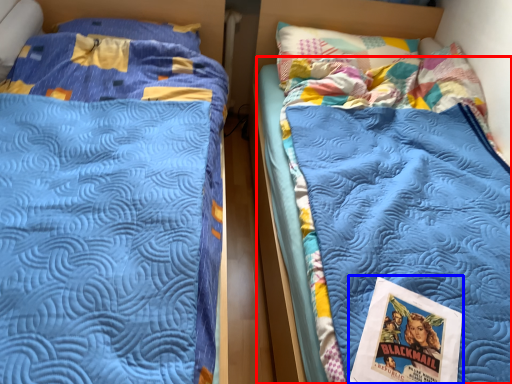
Question: Which point is further to the camera, mattress (highlighted by a red box) or comic book (highlighted by a blue box)?

Choices:
 (A) mattress
 (B) comic book

Answer: (B)